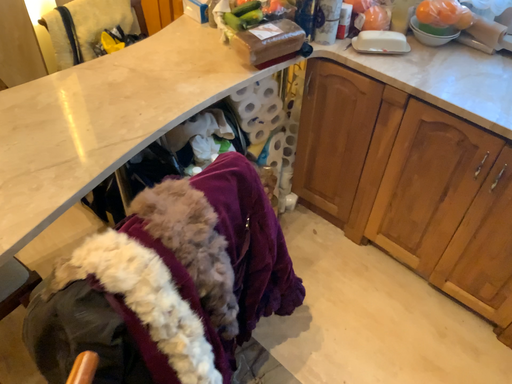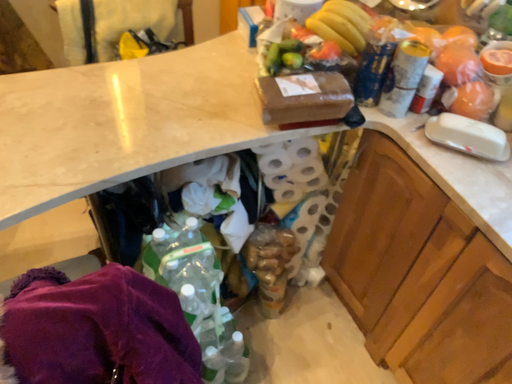
Question: How did the camera likely rotate when shooting the video?

Choices:
 (A) rotated left
 (B) rotated right

Answer: (A)